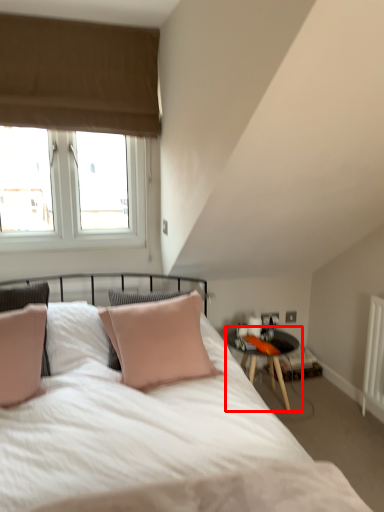
Question: From the image's perspective, where is table (annotated by the red box) located relative to window?

Choices:
 (A) below
 (B) above

Answer: (A)